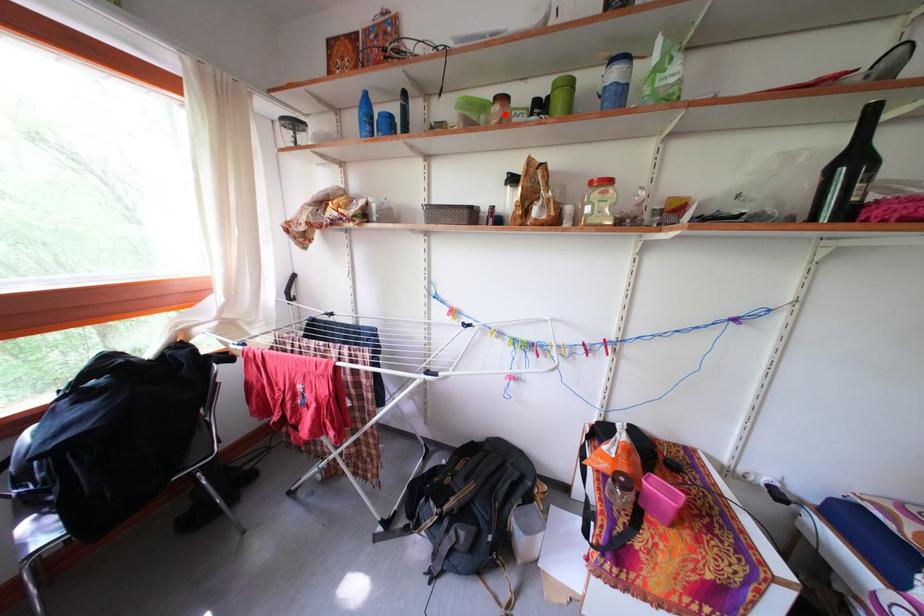
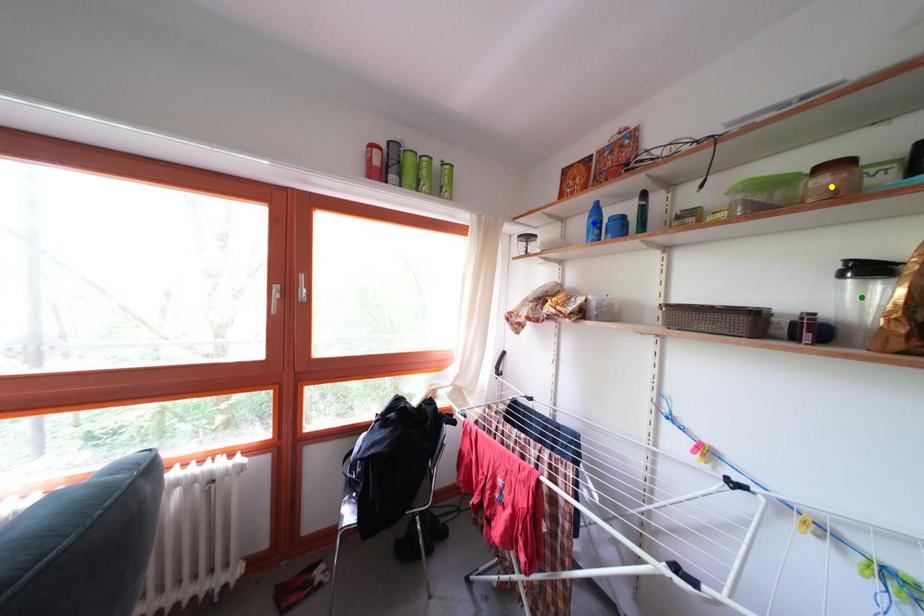
Question: I am providing you with two images of the same scene from different viewpoints. A red point is marked on the first image. You are given multiple points on the second image. Which point in image 2 is actually the same real-world point as the red point in image 1?

Choices:
 (A) blue point
 (B) yellow point
 (C) green point

Answer: (B)